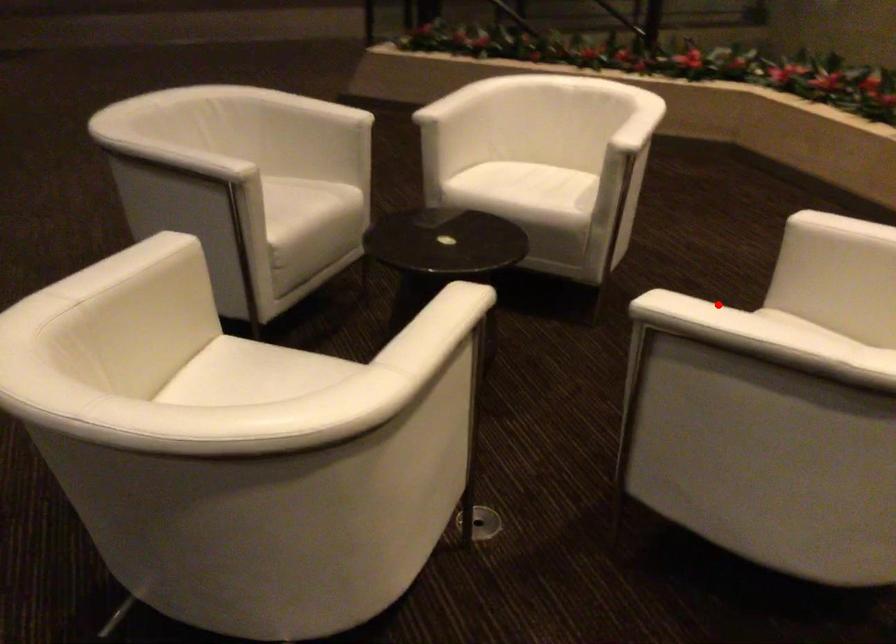
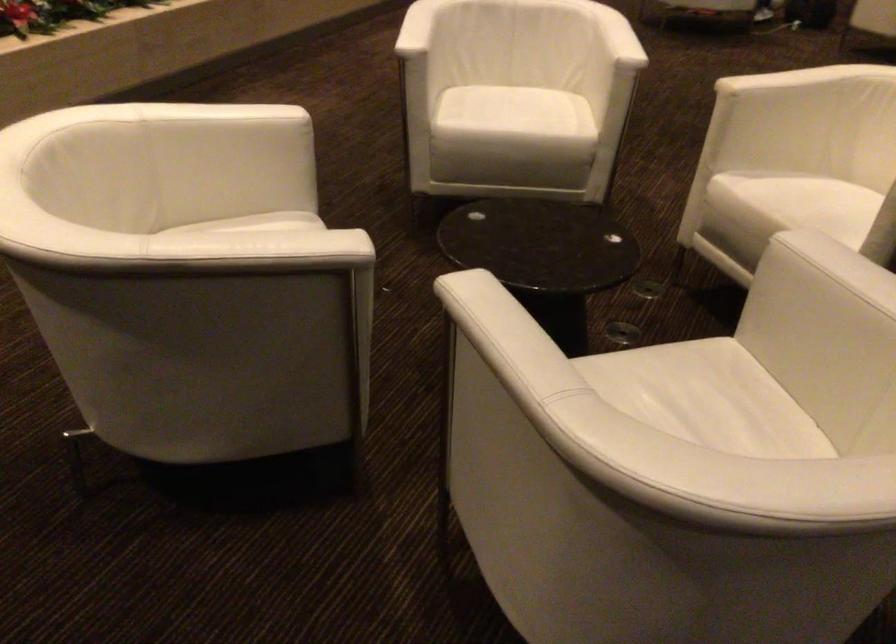
In the second image, find the point that corresponds to the highlighted location in the first image.

(617, 37)